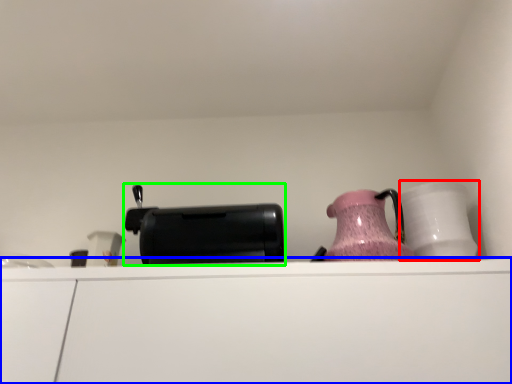
Question: Based on their relative distances, which object is nearer to tableware (highlighted by a red box)? Choose from cabinetry (highlighted by a blue box) and appliance (highlighted by a green box).

Choices:
 (A) cabinetry
 (B) appliance

Answer: (A)